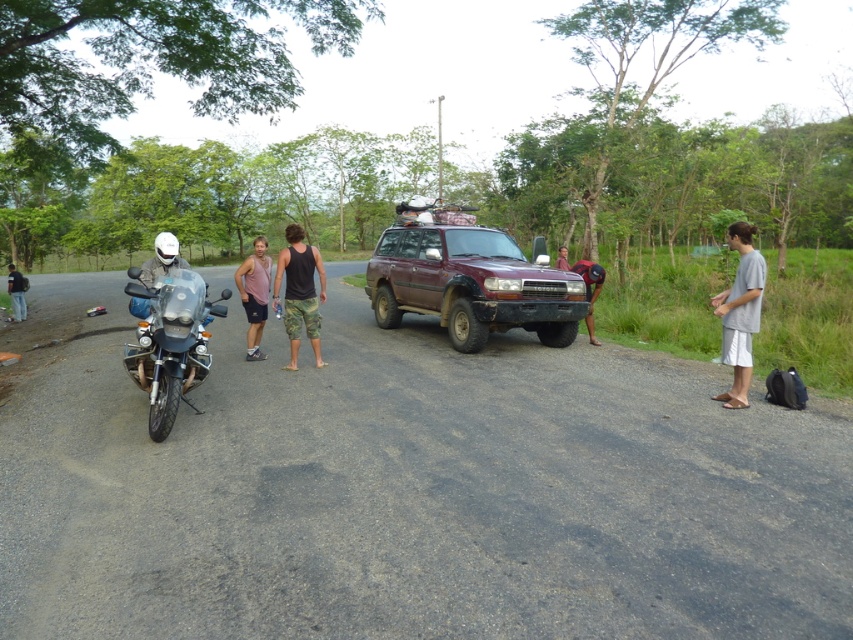
Question: Where is brushed metal helmet at left located in relation to matte black helmet at center in the image?

Choices:
 (A) right
 (B) left

Answer: (B)

Question: Is maroon matte suv at center to the right of gray cotton shirt at right from the viewer's perspective?

Choices:
 (A) no
 (B) yes

Answer: (A)

Question: Estimate the real-world distances between objects in this image. Which object is closer to the camo shorts at center?

Choices:
 (A) pink tank top at center
 (B) maroon matte suv at center

Answer: (A)

Question: Which of these objects is positioned closest to the camo shorts at center?

Choices:
 (A) brushed metal helmet at left
 (B) matte black helmet at center
 (C) shiny metallic motorcycle at left

Answer: (C)

Question: Which object appears farthest from the camera in this image?

Choices:
 (A) maroon matte suv at center
 (B) matte black helmet at center
 (C) gray cotton shirt at right
 (D) dark brown leather pants at center

Answer: (D)

Question: Can you confirm if camo shorts at center is positioned above brushed metal helmet at left?

Choices:
 (A) yes
 (B) no

Answer: (B)